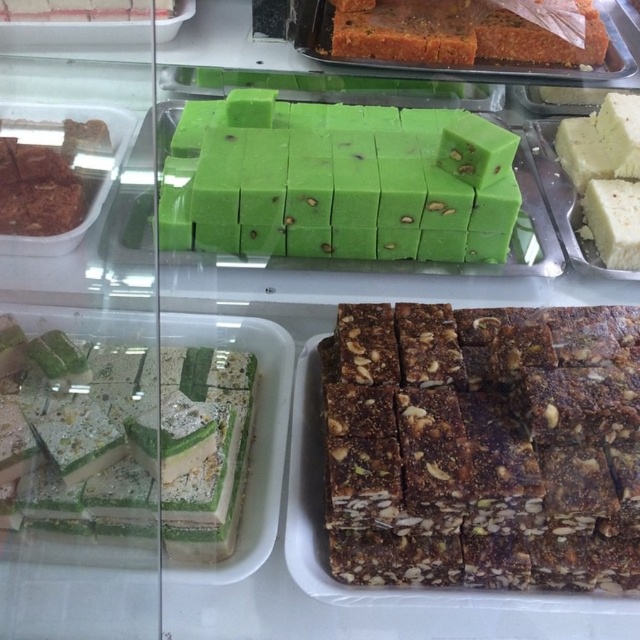
Question: Among these objects, which one is nearest to the camera?

Choices:
 (A) green soft candy at center
 (B) white creamy cake at right

Answer: (A)

Question: Does dark brown crumbly bar at center appear on the left side of green textured cake at lower left?

Choices:
 (A) no
 (B) yes

Answer: (A)

Question: Is dark brown crumbly bar at center positioned in front of green textured cake at lower left?

Choices:
 (A) yes
 (B) no

Answer: (B)

Question: Based on their relative distances, which object is nearer to the green soft candy at center?

Choices:
 (A) green textured cake at lower left
 (B) dark brown crumbly bar at center

Answer: (B)

Question: Which of the following is the closest to the observer?

Choices:
 (A) green soft candy at center
 (B) dark brown crumbly bar at center
 (C) green textured cake at lower left

Answer: (C)

Question: Considering the relative positions of green soft candy at center and white creamy cake at right in the image provided, where is green soft candy at center located with respect to white creamy cake at right?

Choices:
 (A) below
 (B) above

Answer: (B)